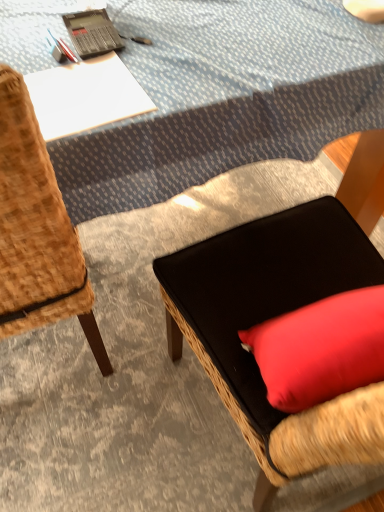
Locate an element on the screen. This screenshot has height=512, width=384. vacant space to the right of black plastic calculator at upper left is located at coordinates (168, 42).